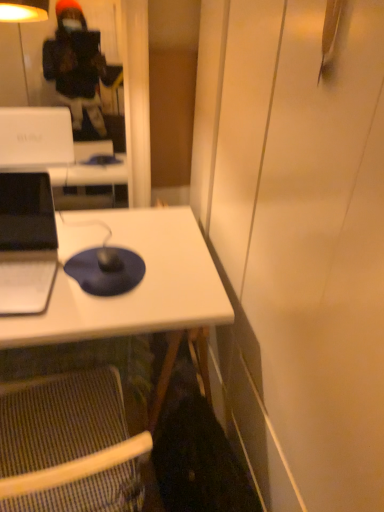
Identify the location of vacant space to the left of blue matte mousepad at center. This screenshot has height=512, width=384. (34, 274).